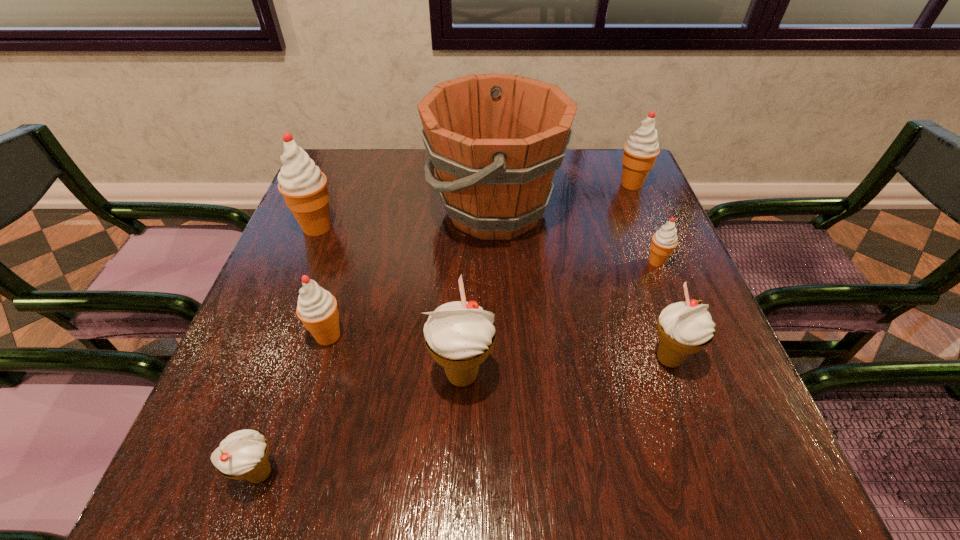
Find the location of a particular element. free space located 0.350m on the back of the nearest red icecream is located at coordinates (365, 213).

You are a GUI agent. You are given a task and a screenshot of the screen. Output one action in this format:
    pyautogui.click(x=<x>, y=<y>)
    Task: Click on the vacant space situated 0.270m on the back of the second biggest white icecream
    This screenshot has width=960, height=540.
    Given the screenshot: What is the action you would take?
    pyautogui.click(x=629, y=245)

At what (x,y) coordinates should I click in order to perform the action: click on free region located on the back of the smallest red icecream. Please return your answer as a coordinate pair (x, y). This screenshot has width=960, height=540. Looking at the image, I should click on (648, 239).

Image resolution: width=960 pixels, height=540 pixels. Find the location of `vacant region located on the back of the nearest object`. vacant region located on the back of the nearest object is located at coordinates (x=321, y=295).

Locate an element on the screen. The width and height of the screenshot is (960, 540). bucket present at the far edge is located at coordinates (495, 140).

What are the coordinates of `icecream present at the far edge` in the screenshot? It's located at (640, 151).

Find the location of a particular element. The height and width of the screenshot is (540, 960). object present at the near edge is located at coordinates (243, 454).

Locate an element on the screen. object present at the near left corner is located at coordinates (243, 454).

Locate an element on the screen. This screenshot has height=540, width=960. object located at the far right corner is located at coordinates (640, 151).

This screenshot has height=540, width=960. Find the location of `vacant area at the near edge`. vacant area at the near edge is located at coordinates (354, 461).